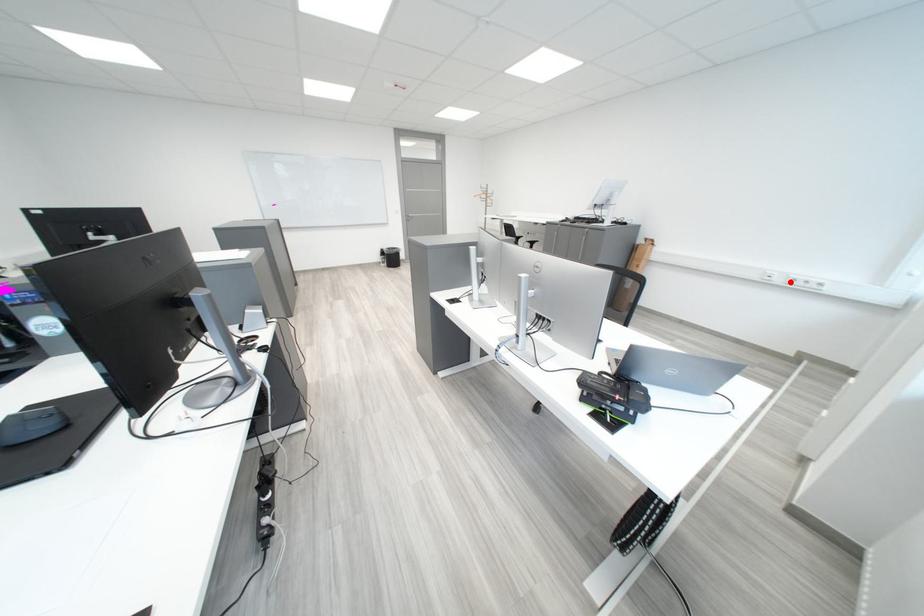
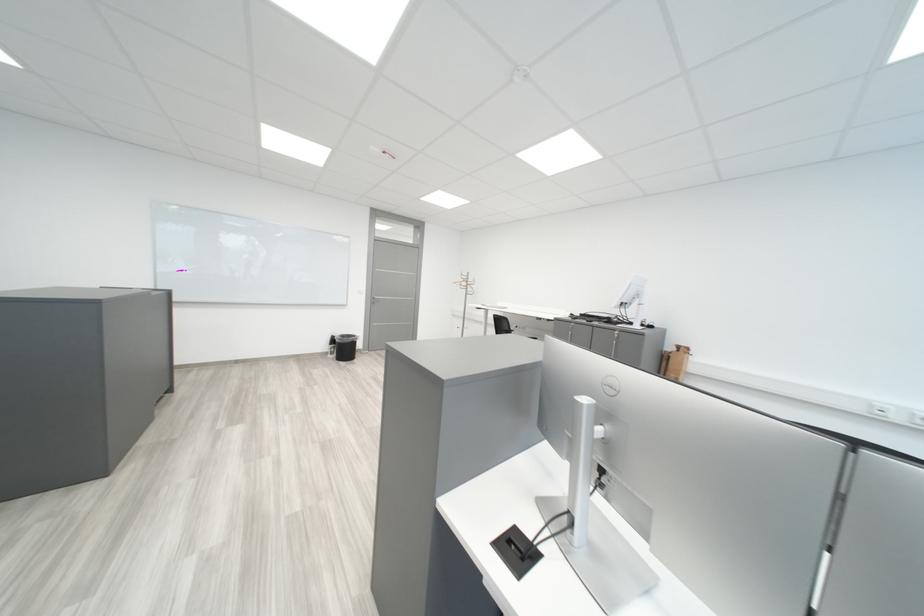
The point at the highlighted location is marked in the first image. Where is the corresponding point in the second image?

(910, 419)